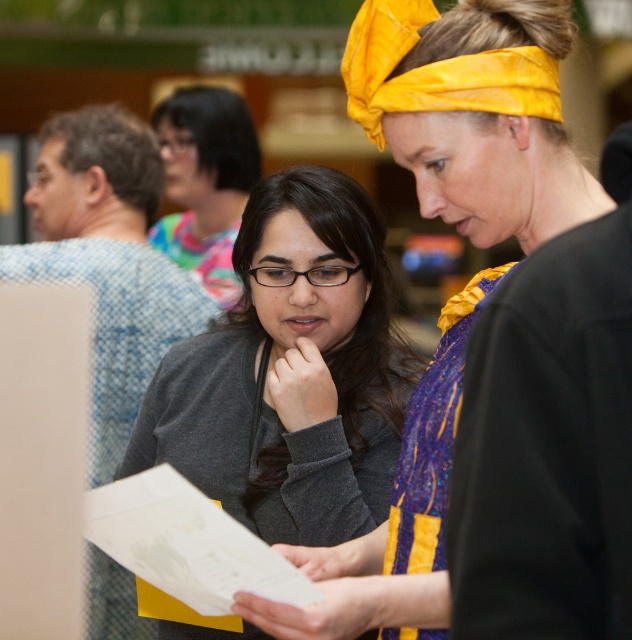
Can you confirm if matte black sweater at center is shorter than gray matte sweater at center?

No, matte black sweater at center is not shorter than gray matte sweater at center.

From the picture: Measure the distance between matte black sweater at center and gray matte sweater at center.

A distance of 23.19 inches exists between matte black sweater at center and gray matte sweater at center.

Locate an element on the screen. matte black sweater at center is located at coordinates (474, 113).

Between gray matte sweater at center and yellow silky headscarf at upper center, which one has less height?

Standing shorter between the two is yellow silky headscarf at upper center.

Based on the photo, does gray matte sweater at center have a lesser width compared to yellow silky headscarf at upper center?

In fact, gray matte sweater at center might be wider than yellow silky headscarf at upper center.

You are a GUI agent. You are given a task and a screenshot of the screen. Output one action in this format:
    pyautogui.click(x=<x>, y=<y>)
    Task: Click on the gray matte sweater at center
    
    Given the screenshot: What is the action you would take?
    pyautogui.click(x=289, y=372)

Based on the photo, which is more to the right, matte black sweater at center or yellow silky headscarf at upper center?

yellow silky headscarf at upper center

Does matte black sweater at center lie in front of yellow silky headscarf at upper center?

That is True.

Where is `matte black sweater at center`? The width and height of the screenshot is (632, 640). matte black sweater at center is located at coordinates (474, 113).